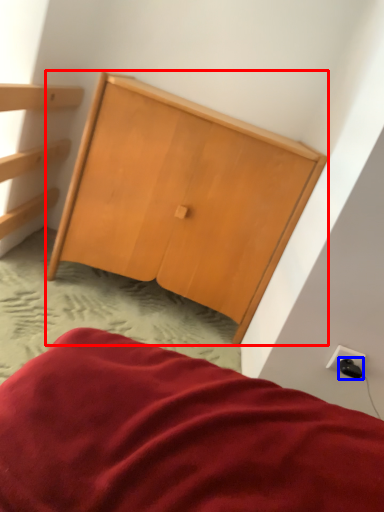
Question: Which object is closer to the camera taking this photo, furniture (highlighted by a red box) or plug (highlighted by a blue box)?

Choices:
 (A) furniture
 (B) plug

Answer: (B)